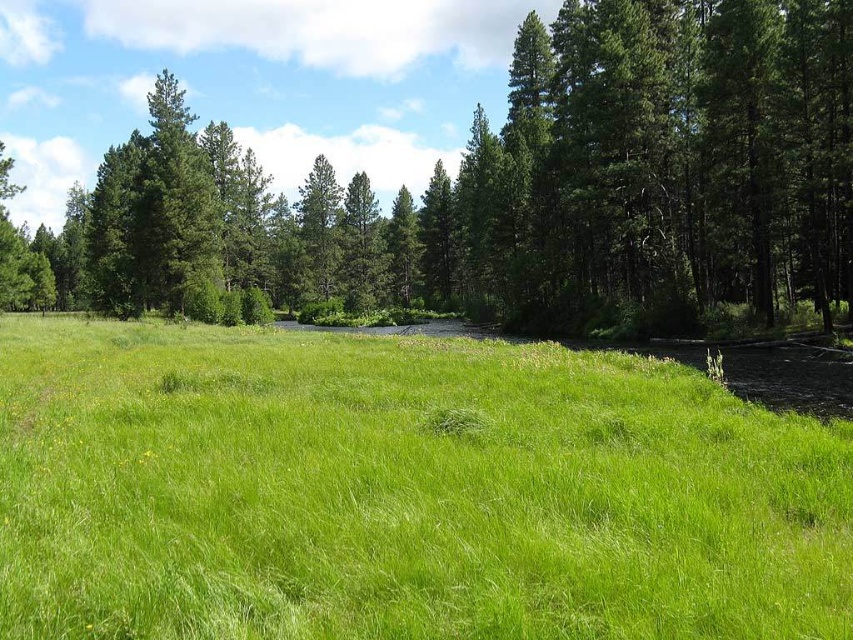
Question: Is green grassy at center closer to camera compared to green leafy tree at center?

Choices:
 (A) yes
 (B) no

Answer: (A)

Question: Can you confirm if green grassy at center is bigger than green leafy tree at center?

Choices:
 (A) no
 (B) yes

Answer: (A)

Question: Is green grassy at center positioned before green leafy tree at center?

Choices:
 (A) no
 (B) yes

Answer: (B)

Question: Which point is farther to the camera?

Choices:
 (A) (532, 128)
 (B) (550, 545)

Answer: (A)